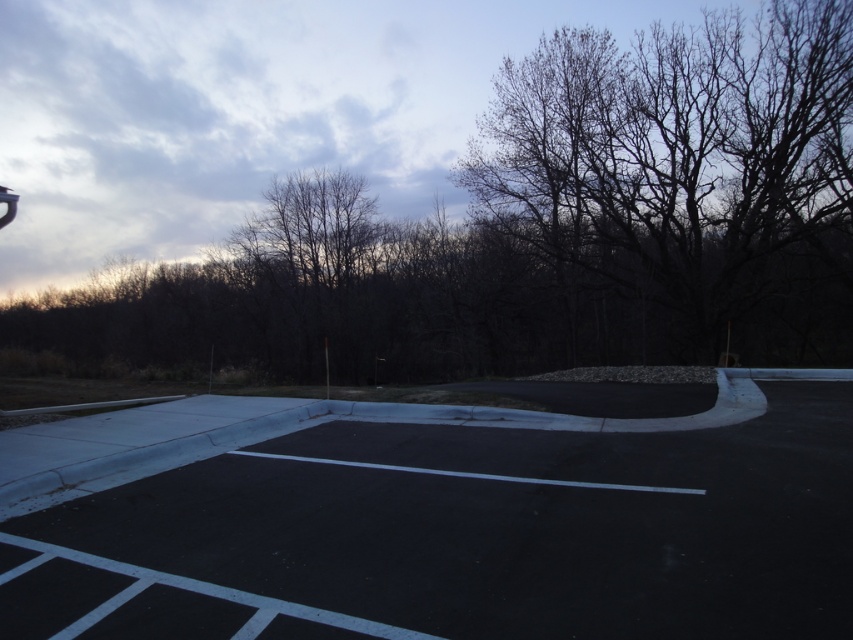
Question: Which object appears closest to the camera in this image?

Choices:
 (A) bare branches at upper right
 (B) black asphalt parking lot at center

Answer: (B)

Question: Which point is closer to the camera?

Choices:
 (A) (79, 557)
 (B) (585, 49)

Answer: (A)

Question: Which of the following is the farthest from the observer?

Choices:
 (A) (724, 627)
 (B) (703, 113)

Answer: (B)

Question: Is black asphalt parking lot at center behind bare branches at upper right?

Choices:
 (A) no
 (B) yes

Answer: (A)

Question: Is black asphalt parking lot at center thinner than bare branches at upper right?

Choices:
 (A) yes
 (B) no

Answer: (A)

Question: Can you confirm if black asphalt parking lot at center is positioned to the left of bare branches at upper right?

Choices:
 (A) yes
 (B) no

Answer: (A)